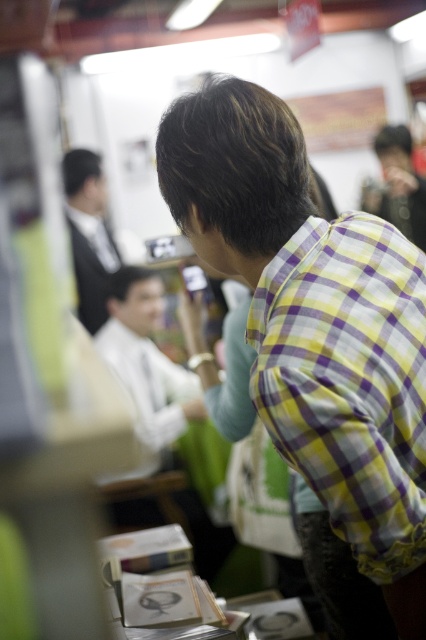
Question: Is yellow-purple checkered shirt at center below white shirt at center?

Choices:
 (A) no
 (B) yes

Answer: (A)

Question: Among these objects, which one is nearest to the camera?

Choices:
 (A) formal black suit at upper left
 (B) matte black camera at upper right
 (C) white shirt at center

Answer: (C)

Question: Among these points, which one is nearest to the camera?

Choices:
 (A) (400, 145)
 (B) (144, 314)
 (C) (356, 387)
 (D) (66, 161)

Answer: (C)

Question: Can you confirm if white shirt at center is positioned below matte black camera at upper right?

Choices:
 (A) yes
 (B) no

Answer: (A)

Question: Does white shirt at center appear under matte black camera at upper right?

Choices:
 (A) no
 (B) yes

Answer: (B)

Question: Among these objects, which one is farthest from the camera?

Choices:
 (A) matte black camera at upper right
 (B) yellow-purple checkered shirt at center

Answer: (A)